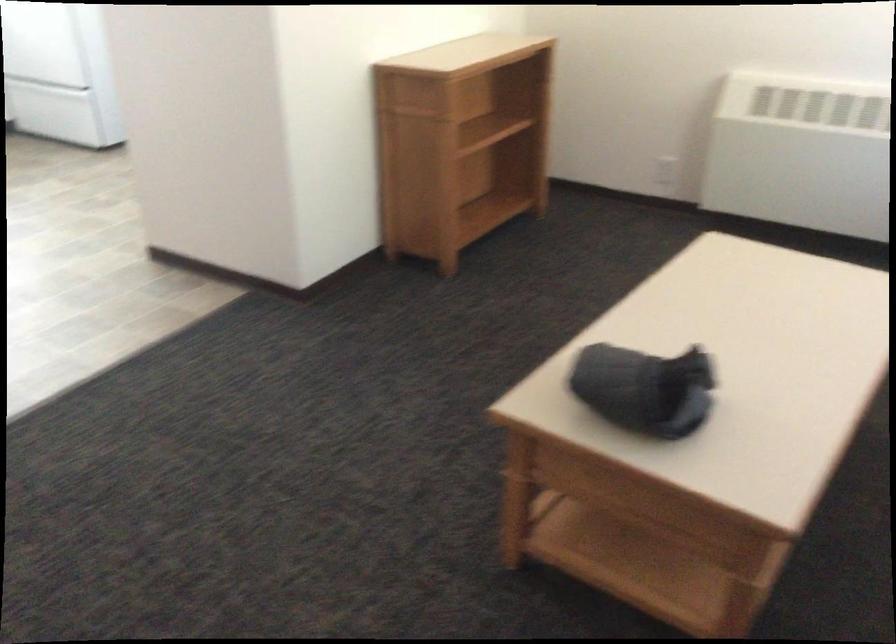
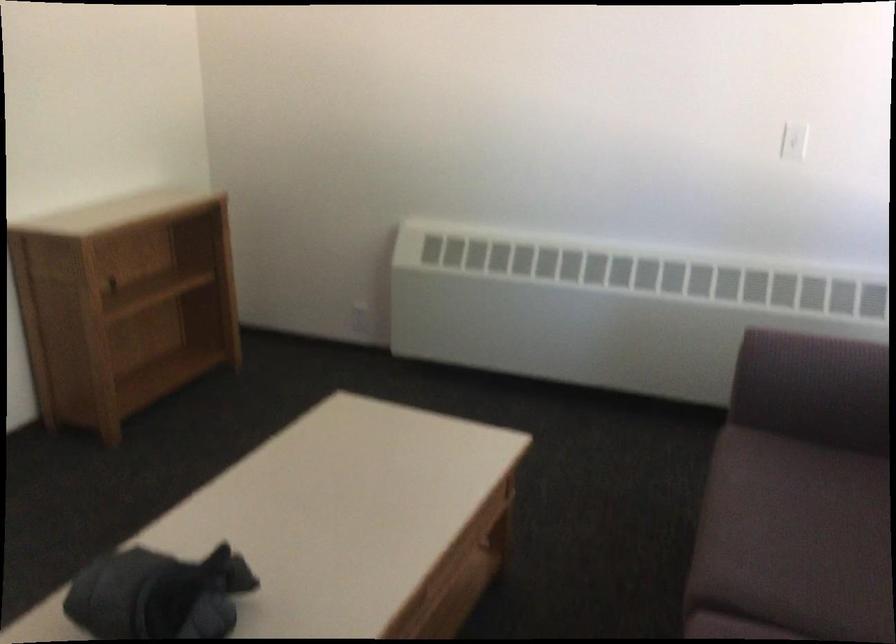
Question: What movement of the cameraman would produce the second image?

Choices:
 (A) Left
 (B) Right
 (C) Forward
 (D) Backward

Answer: (B)